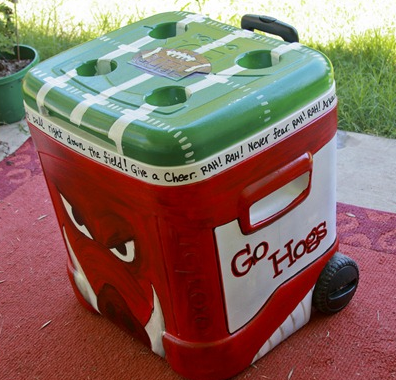
The height and width of the screenshot is (380, 396). I want to click on potted plant, so click(19, 77).